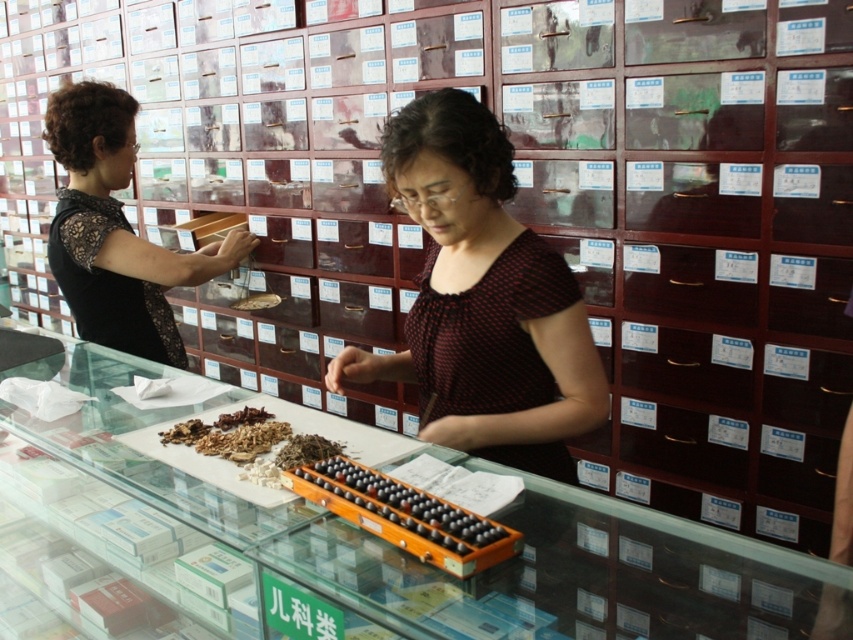
Based on the photo, is dark red dotted blouse at center above brown crumbly herbs at center?

Indeed, dark red dotted blouse at center is positioned over brown crumbly herbs at center.

Can you confirm if dark red dotted blouse at center is bigger than brown crumbly herbs at center?

Indeed, dark red dotted blouse at center has a larger size compared to brown crumbly herbs at center.

The height and width of the screenshot is (640, 853). Identify the location of dark red dotted blouse at center. (482, 300).

Who is positioned more to the left, dark red dotted blouse at center or wooden abacus at center?

Positioned to the left is wooden abacus at center.

This screenshot has width=853, height=640. I want to click on dark red dotted blouse at center, so 482,300.

Does matte black dress at left have a smaller size compared to wooden abacus at center?

Actually, matte black dress at left might be larger than wooden abacus at center.

Can you confirm if matte black dress at left is bigger than wooden abacus at center?

Yes.

Where is `matte black dress at left`? Image resolution: width=853 pixels, height=640 pixels. matte black dress at left is located at coordinates tap(115, 230).